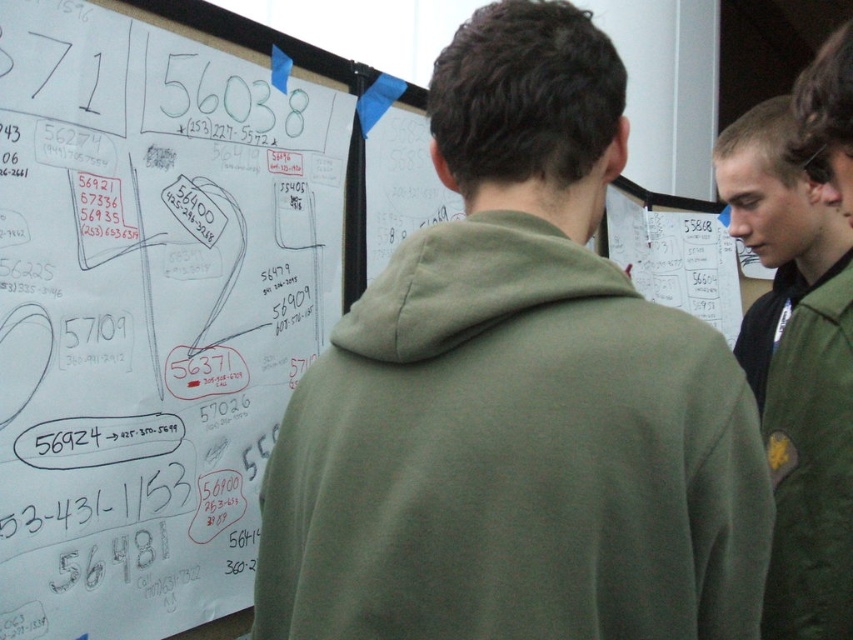
You are standing at the origin point of the coordinate system in this image. You need to locate the green matte hoodie at center. What are its coordinates?

The green matte hoodie at center is located at coordinates point (515, 397).

You are standing in front of the white paperboard at upper left and the green matte jacket at upper right. Which object is located more to the left?

The white paperboard at upper left is positioned on the left side of green matte jacket at upper right, so it is more to the left.

You are standing in front of the whiteboard and see two points plotted on it. The first point is labeled as point (698, 589) and the second is point (848, 577). Which of these points is closer to the bottom edge of the whiteboard?

Point (698, 589) is closer to the bottom edge of the whiteboard because it has a lower y coordinate than point (848, 577).